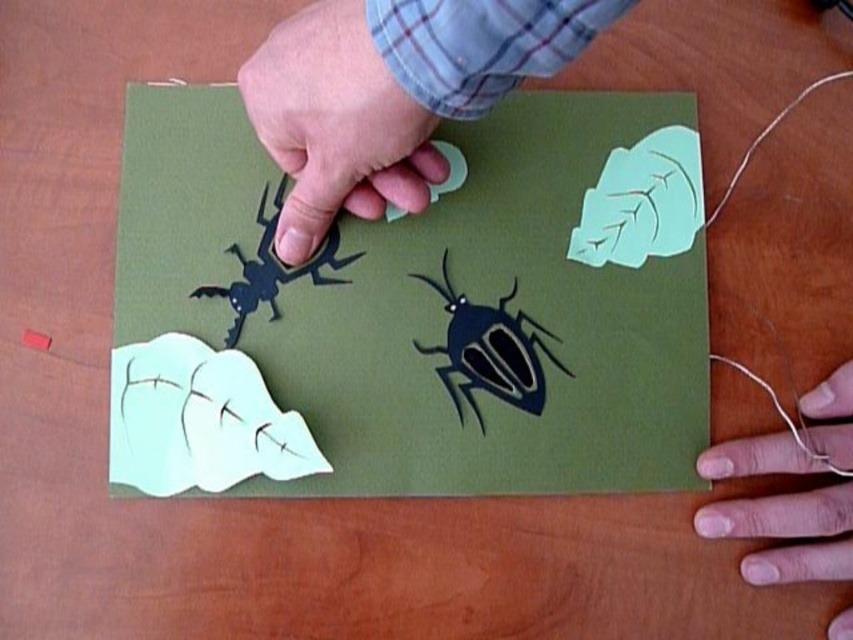
You are an artist trying to arrange the matte green paper at center and the matte black beetle at center on a display board. Based on the scene, which object should you place first to ensure proper alignment?

The matte green paper at center should be placed first because it might be wider than the matte black beetle at center, allowing for better alignment and positioning.

You are an artist working on a paper craft project. You have a matte green paper at center and a smooth skin hand at lower right. Which object is covering the other?

The matte green paper at center is positioned over the smooth skin hand at lower right, so the matte green paper is covering the hand.